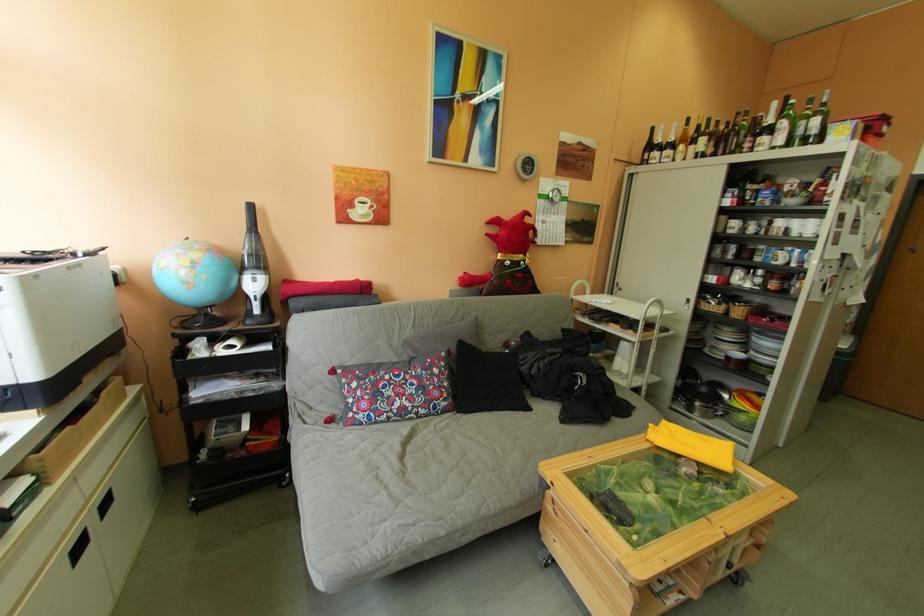
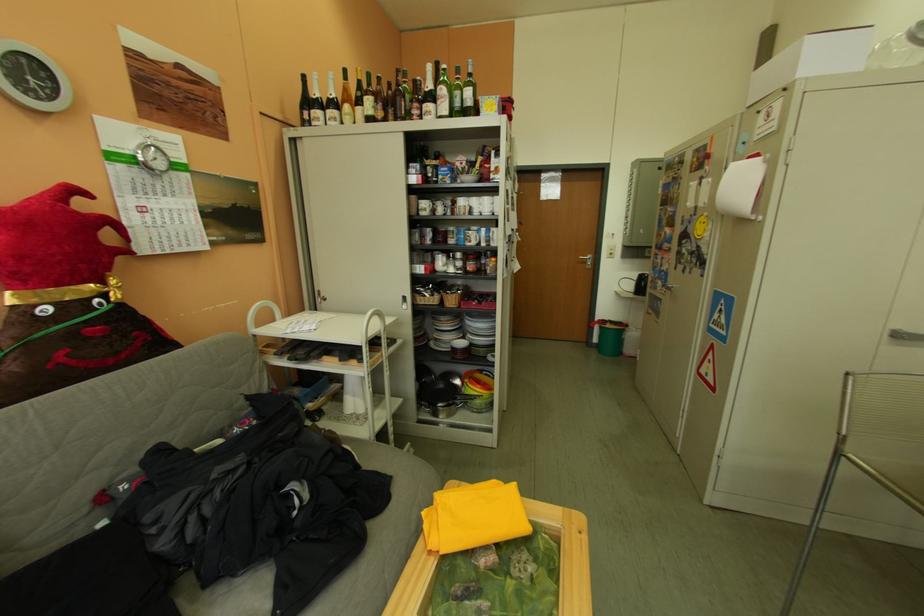
The point at (659, 160) is marked in the first image. Where is the corresponding point in the second image?

(320, 120)